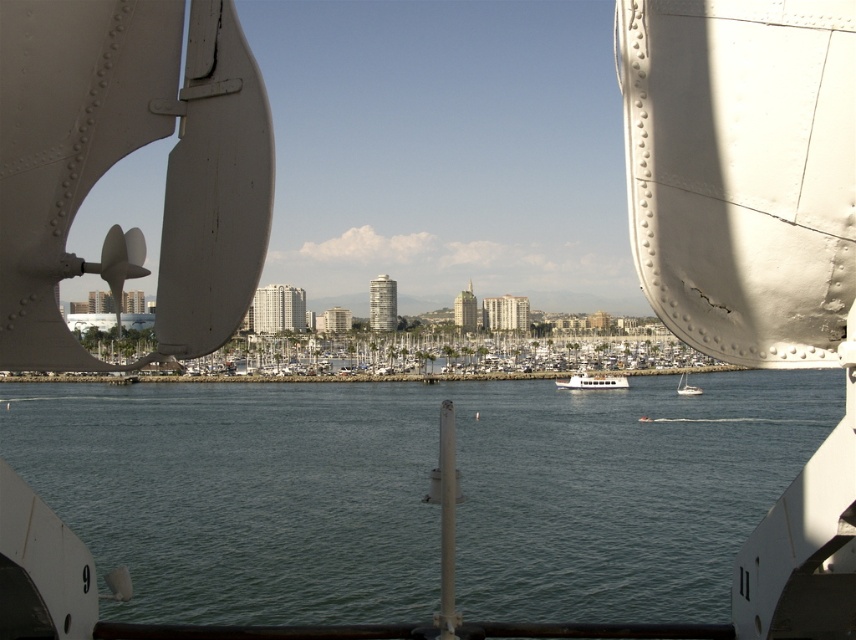
You are standing on the deck of a ship and want to know how far you are from the point marked at coordinates [188,492]. Can you determine the distance?

The point at coordinates [188,492] is 468.90 feet away from the camera, so the distance is 468.90 feet.